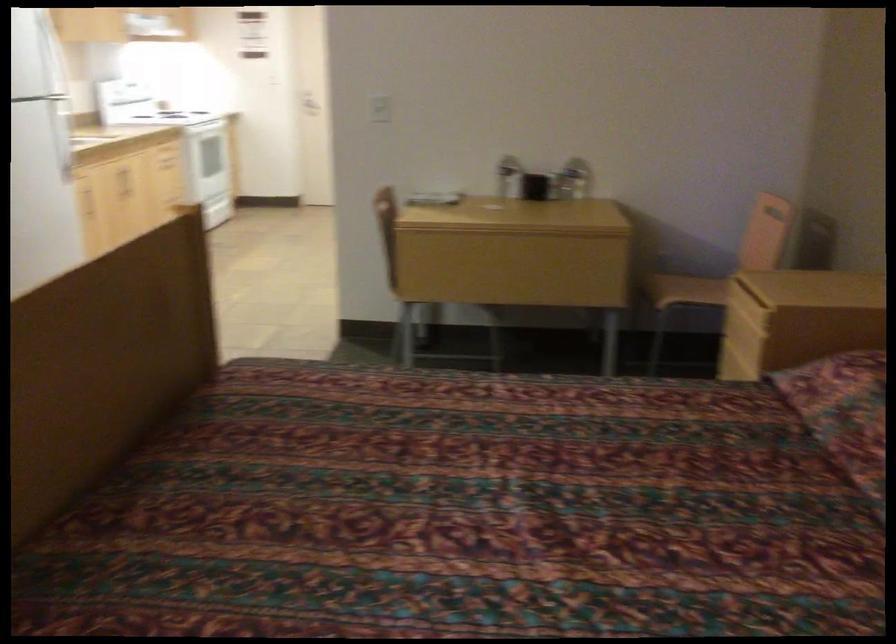
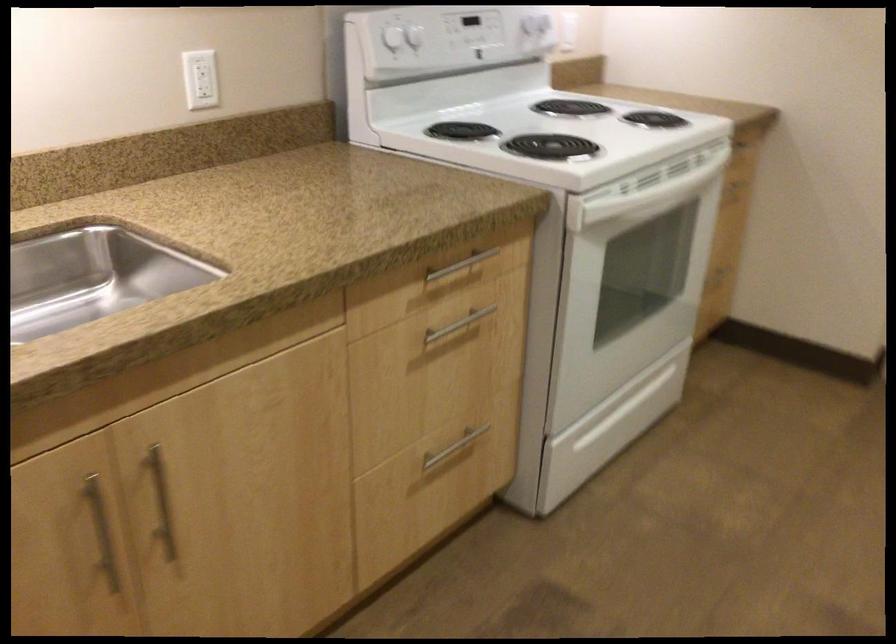
In the second image, find the point that corresponds to pixel 177 151 in the first image.

(457, 325)